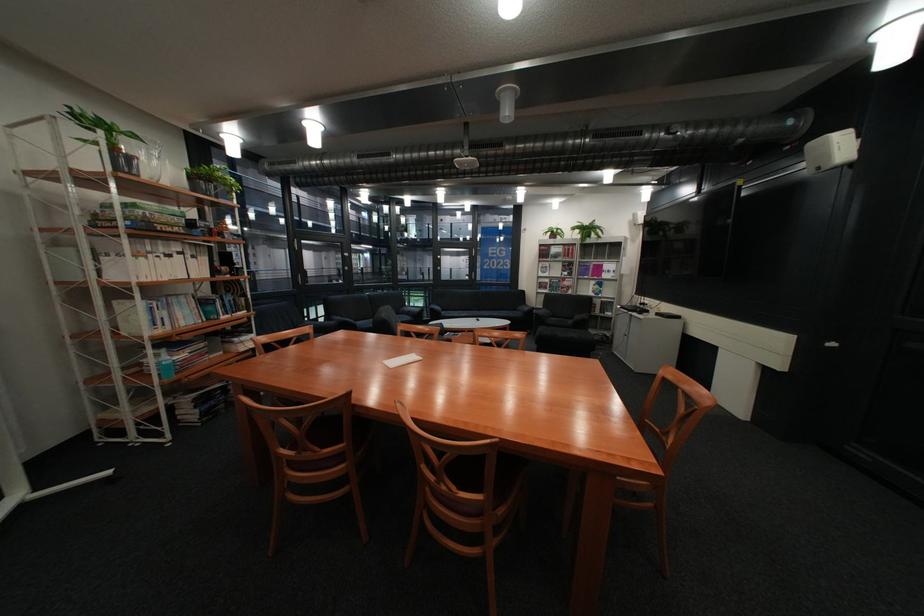
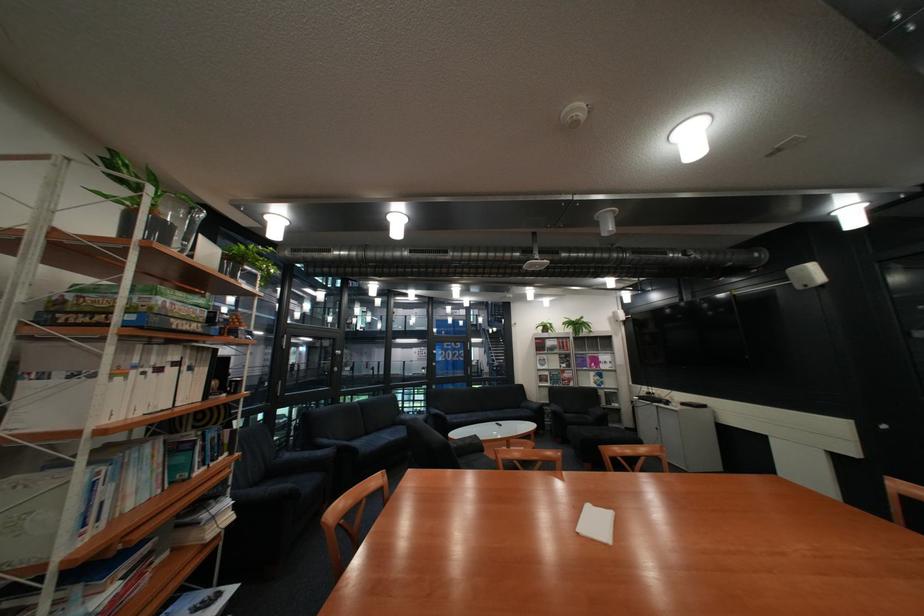
The point at (123, 140) is marked in the first image. Where is the corresponding point in the second image?

(168, 199)